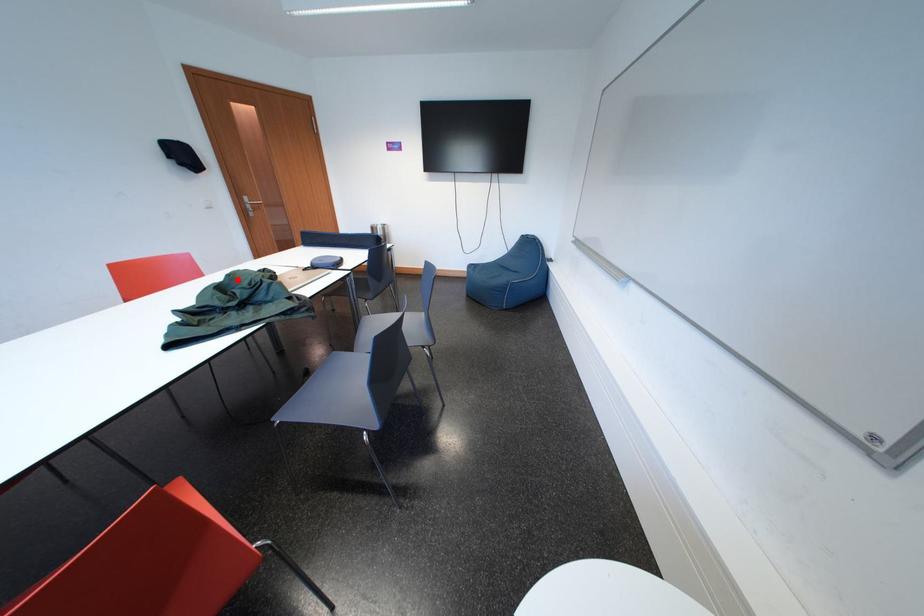
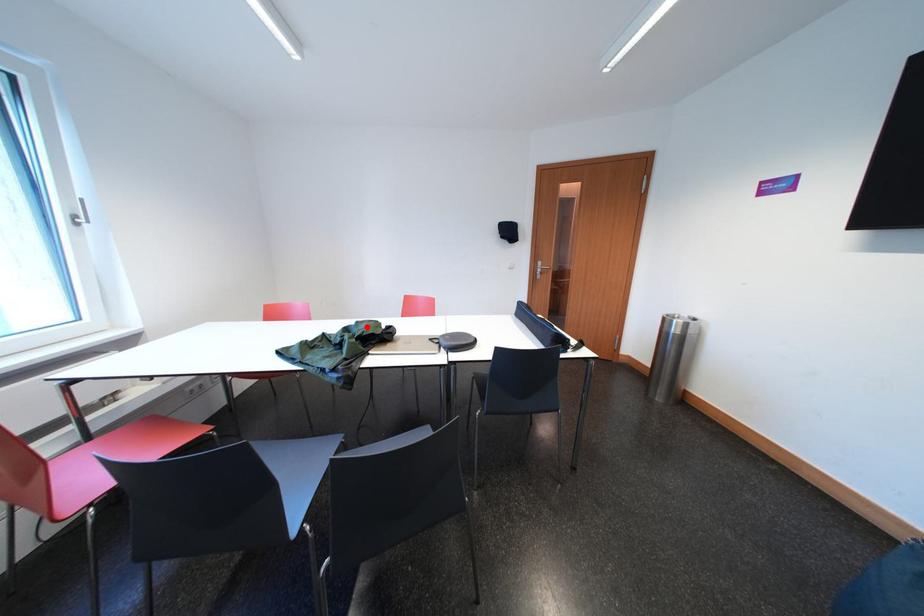
Consider the image. I am providing you with two images of the same scene from different viewpoints. A red point is marked on the first image and another point is marked on the second image. Is the red point in image1 aligned with the point shown in image2?

Yes